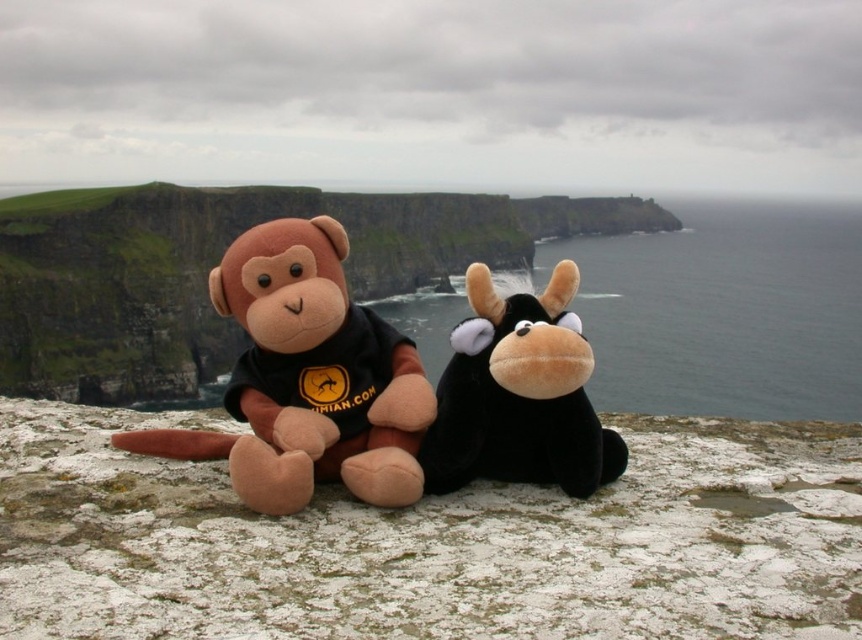
What do you see at coordinates (217, 262) in the screenshot? I see `green grass cliff at center` at bounding box center [217, 262].

From the picture: Can you confirm if green grass cliff at center is positioned to the left of brown plush monkey at left?

In fact, green grass cliff at center is to the right of brown plush monkey at left.

Which is behind, point (183, 371) or point (384, 364)?

The point (183, 371) is behind.

Locate an element on the screen. green grass cliff at center is located at coordinates (217, 262).

Is point (92, 445) farther from viewer compared to point (130, 449)?

Yes, point (92, 445) is behind point (130, 449).

Can you confirm if brown plush monkey at center is smaller than brown plush monkey at left?

Incorrect, brown plush monkey at center is not smaller in size than brown plush monkey at left.

Find the location of a particular element. brown plush monkey at center is located at coordinates (431, 544).

Is brown plush monkey at left taller than black plush cow at center?

Indeed, brown plush monkey at left has a greater height compared to black plush cow at center.

Is brown plush monkey at left smaller than black plush cow at center?

No, brown plush monkey at left is not smaller than black plush cow at center.

This screenshot has width=862, height=640. I want to click on brown plush monkey at left, so click(x=307, y=378).

This screenshot has width=862, height=640. Find the location of `brown plush monkey at left`. brown plush monkey at left is located at coordinates (307, 378).